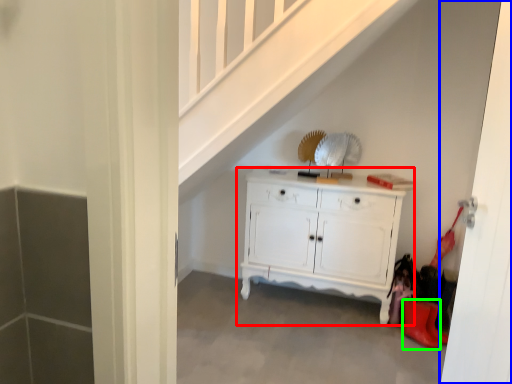
Question: Which object is positioned closest to chest of drawers (highlighted by a red box)? Select from door (highlighted by a blue box) and shoe (highlighted by a green box).

Choices:
 (A) door
 (B) shoe

Answer: (B)